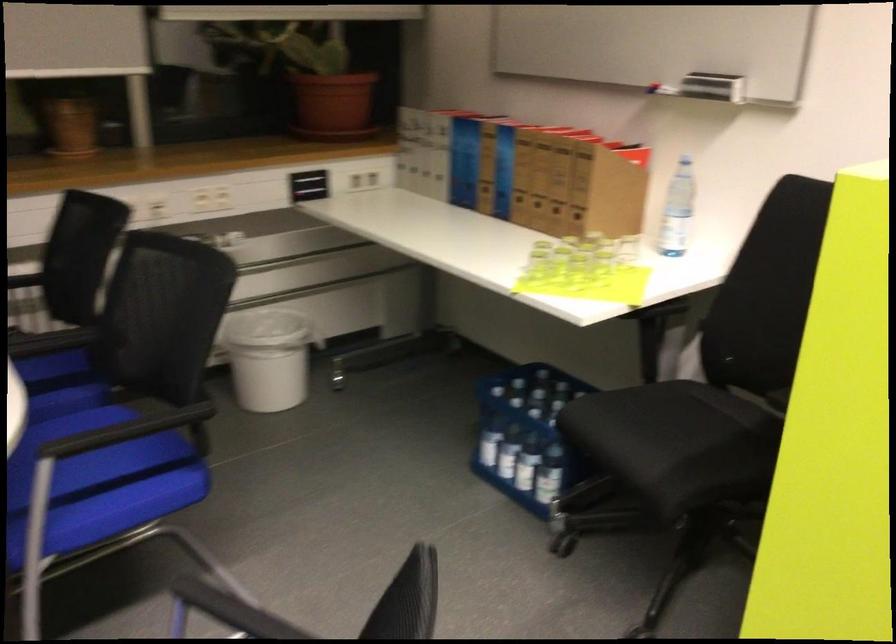
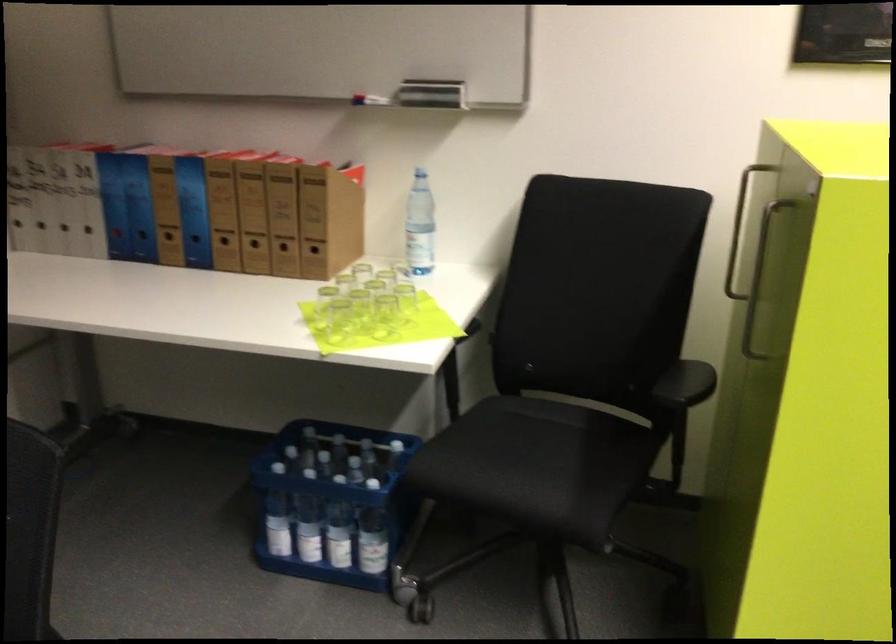
Where in the second image is the point corresponding to (685,442) from the first image?

(552, 462)